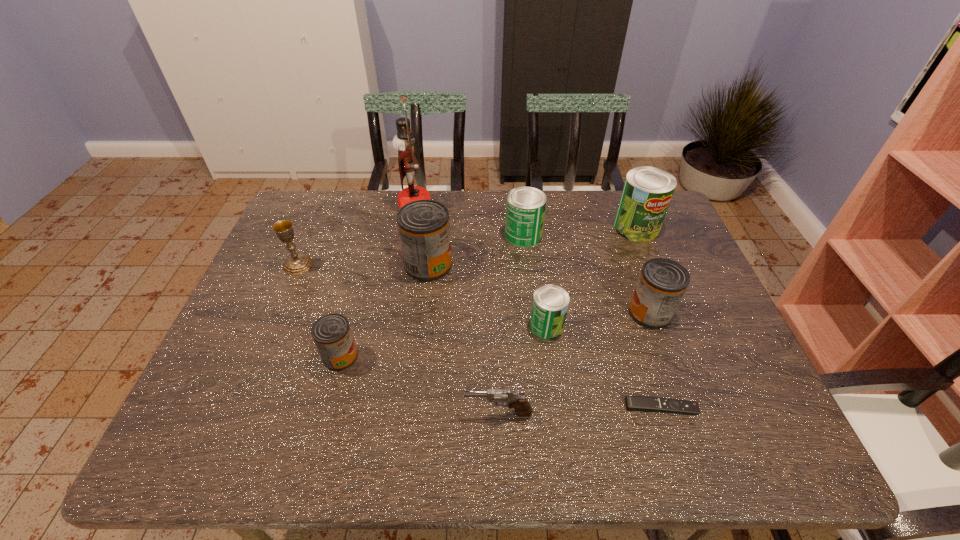
Select which red can is the second closest to the second object from left to right. Please provide its 2D coordinates. Your answer should be formatted as a tuple, i.e. [(x, y)], where the tuple contains the x and y coordinates of a point satisfying the conditions above.

[(662, 283)]

This screenshot has width=960, height=540. I want to click on the second closest green can to the rightmost green can, so click(550, 304).

At what (x,y) coordinates should I click in order to perform the action: click on the third closest green can to the biggest red can. Please return your answer as a coordinate pair (x, y). Image resolution: width=960 pixels, height=540 pixels. Looking at the image, I should click on (647, 192).

Identify the location of vacant space that satisfies the following two spatial constraints: 1. on the front-facing side of the biggest green can; 2. on the left side of the nutcracker. The height and width of the screenshot is (540, 960). (412, 227).

Where is `free point that satisfies the following two spatial constraints: 1. on the back side of the second biggest red can; 2. on the right side of the leftmost can`? This screenshot has height=540, width=960. free point that satisfies the following two spatial constraints: 1. on the back side of the second biggest red can; 2. on the right side of the leftmost can is located at coordinates (x=352, y=313).

Identify the location of free point that satisfies the following two spatial constraints: 1. on the front-facing side of the red nutcracker; 2. on the front side of the leftmost object. Image resolution: width=960 pixels, height=540 pixels. (405, 265).

Where is `vacant position in the image that satisfies the following two spatial constraints: 1. on the front side of the second smallest red can; 2. at the barrel of the pistol`? The height and width of the screenshot is (540, 960). vacant position in the image that satisfies the following two spatial constraints: 1. on the front side of the second smallest red can; 2. at the barrel of the pistol is located at coordinates (685, 413).

Locate an element on the screen. This screenshot has height=540, width=960. free space that satisfies the following two spatial constraints: 1. on the back side of the smallest red can; 2. on the right side of the biggest green can is located at coordinates (375, 227).